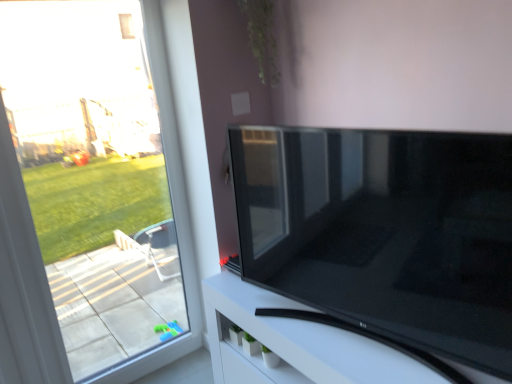
Question: Is matte black tv at center taller than black glossy tv stand at lower right?

Choices:
 (A) no
 (B) yes

Answer: (B)

Question: Is matte black tv at center smaller than black glossy tv stand at lower right?

Choices:
 (A) yes
 (B) no

Answer: (A)

Question: From the image's perspective, is matte black tv at center under black glossy tv stand at lower right?

Choices:
 (A) no
 (B) yes

Answer: (A)

Question: Is matte black tv at center not inside black glossy tv stand at lower right?

Choices:
 (A) yes
 (B) no

Answer: (A)

Question: Is matte black tv at center further to camera compared to black glossy tv stand at lower right?

Choices:
 (A) no
 (B) yes

Answer: (A)

Question: From a real-world perspective, is matte black tv at center under black glossy tv stand at lower right?

Choices:
 (A) yes
 (B) no

Answer: (B)

Question: Is matte black tv at center with green matte plant at upper center?

Choices:
 (A) yes
 (B) no

Answer: (B)

Question: From the image's perspective, is matte black tv at center located beneath green matte plant at upper center?

Choices:
 (A) no
 (B) yes

Answer: (B)

Question: Does matte black tv at center have a greater width compared to green matte plant at upper center?

Choices:
 (A) no
 (B) yes

Answer: (B)

Question: Does matte black tv at center have a larger size compared to green matte plant at upper center?

Choices:
 (A) yes
 (B) no

Answer: (A)

Question: Are matte black tv at center and green matte plant at upper center far apart?

Choices:
 (A) yes
 (B) no

Answer: (B)

Question: Could green matte plant at upper center be considered to be inside matte black tv at center?

Choices:
 (A) no
 (B) yes

Answer: (A)

Question: Does black glossy tv stand at lower right appear on the right side of transparent glass window at left?

Choices:
 (A) no
 (B) yes

Answer: (B)